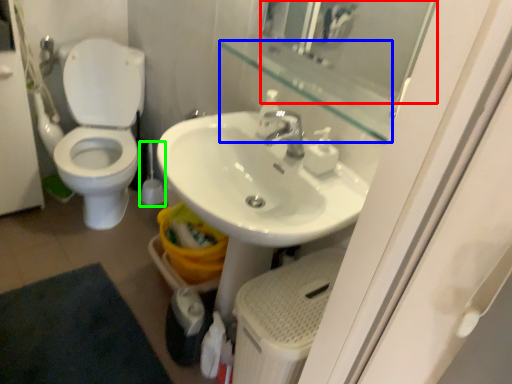
Question: Estimate the real-world distances between objects in this image. Which object is farther from mirror (highlighted by a red box), balustrade (highlighted by a blue box) or brush (highlighted by a green box)?

Choices:
 (A) balustrade
 (B) brush

Answer: (B)